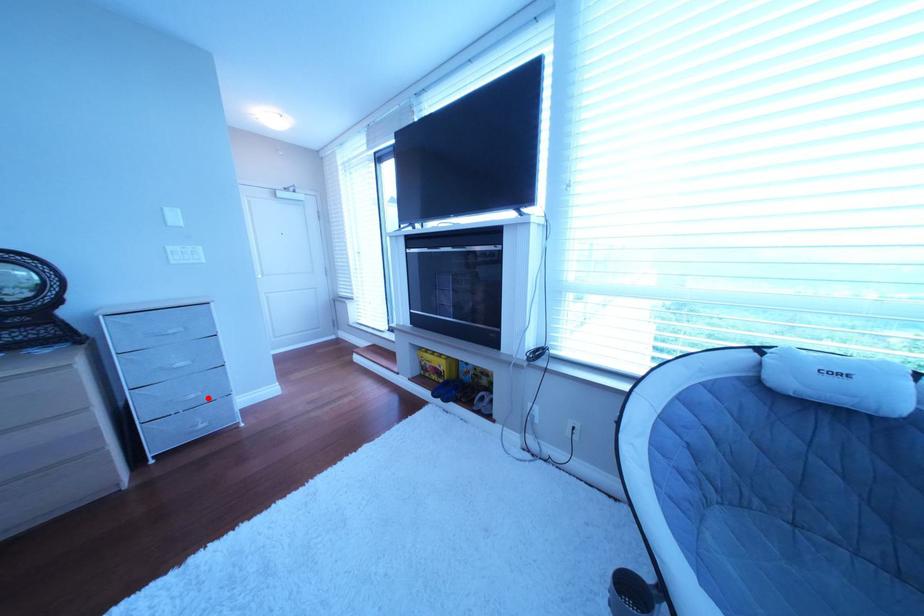
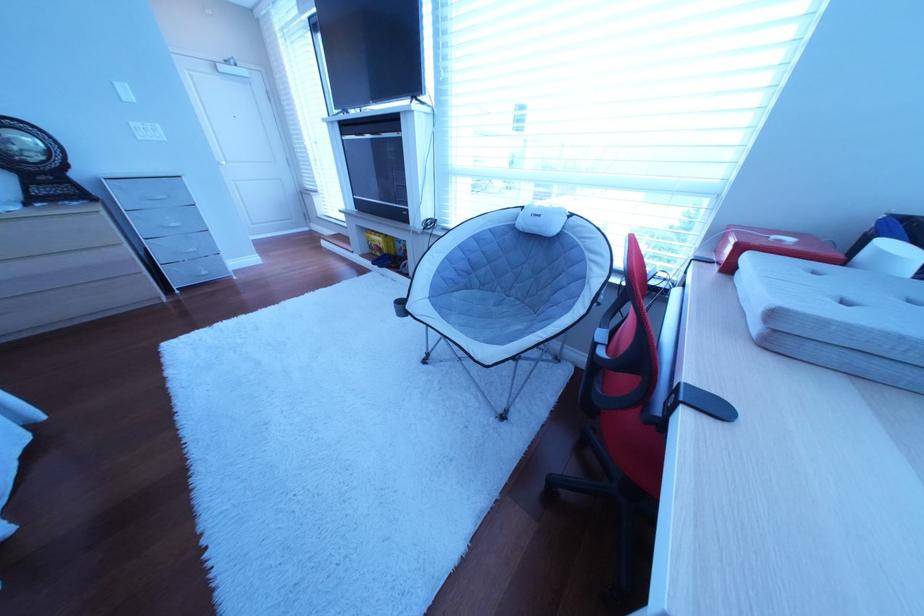
Question: A red point is marked in image1. In image2, is the corresponding 3D point closer to the camera or farther? Reply with the corresponding letter.

Choices:
 (A) The corresponding 3D point is closer.
 (B) The corresponding 3D point is farther.

Answer: (A)